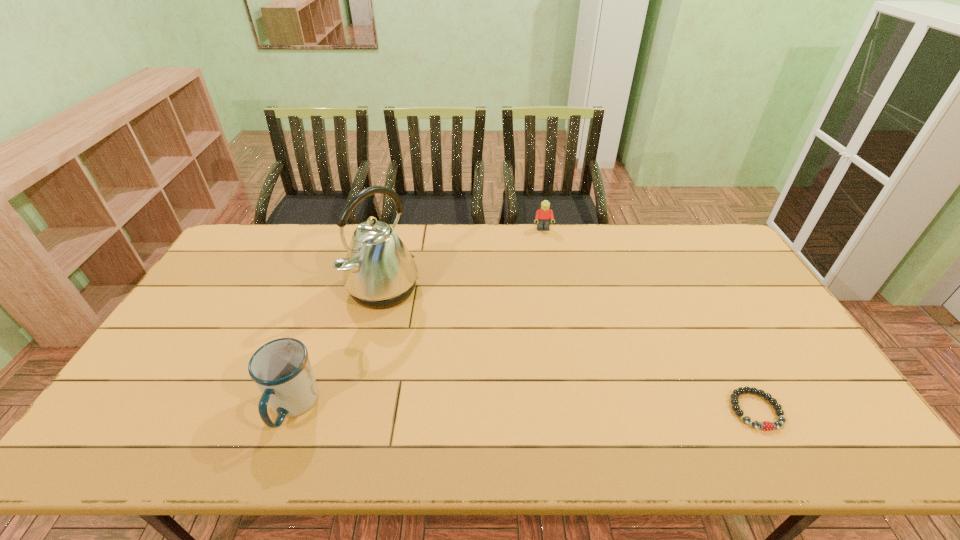
At what (x,y) coordinates should I click in order to perform the action: click on free spot at the near edge of the desktop. Please return your answer as a coordinate pair (x, y). Looking at the image, I should click on (357, 411).

This screenshot has height=540, width=960. Find the location of `vacant space at the left edge of the desktop`. vacant space at the left edge of the desktop is located at coordinates (173, 359).

I want to click on free location at the right edge, so click(778, 326).

This screenshot has width=960, height=540. I want to click on vacant space at the far left corner of the desktop, so click(x=259, y=235).

What are the coordinates of `free space at the far right corner of the desktop` in the screenshot? It's located at (708, 230).

Where is `vacant area that lies between the bracelet and the kettle`? The image size is (960, 540). vacant area that lies between the bracelet and the kettle is located at coordinates (569, 350).

Find the location of a particular element. free point between the kettle and the rightmost object is located at coordinates (569, 350).

The image size is (960, 540). I want to click on free point between the second shortest object and the second tallest object, so click(x=418, y=318).

Where is `vacant space in between the rightmost object and the kettle`? vacant space in between the rightmost object and the kettle is located at coordinates (569, 350).

The image size is (960, 540). Identify the location of free spot between the second farthest object and the bracelet. (569, 350).